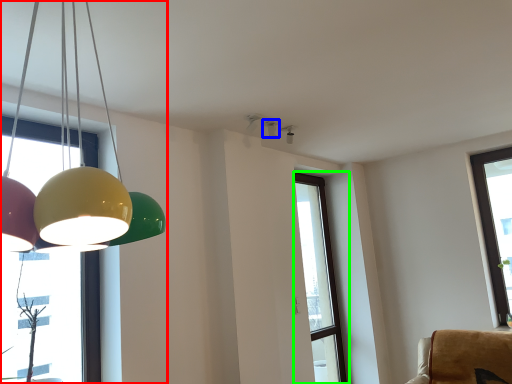
Question: Which object is positioned farthest from lamp (highlighted by a red box)? Select from lamp (highlighted by a blue box) and window (highlighted by a green box).

Choices:
 (A) lamp
 (B) window

Answer: (B)